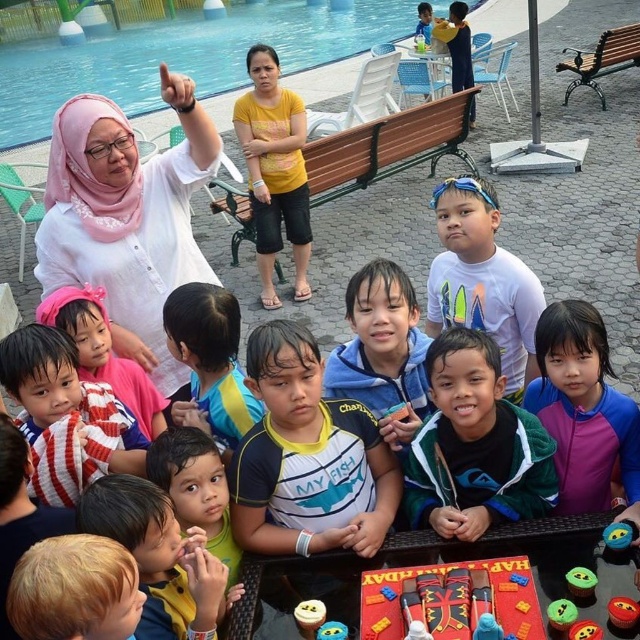
You are standing at the center of the paved area and want to find the striped jersey at center. Which direction should you walk to reach it?

The striped jersey at center is located at point 0.652 on the x axis and 0.105 on the y axis. Since you are at the center, which is at point 0.5 on both axes, you should walk towards the right and slightly downward to reach the striped jersey at center.

Based on the photo, you are a parent at the birthday party and want to place a new toy between the blue plastic pool at upper left and the smooth plastic toy at lower right. Where should you place it so it is between them?

You should place the new toy between the blue plastic pool at upper left and the smooth plastic toy at lower right by positioning it below the blue plastic pool at upper left and above the smooth plastic toy at lower right since the blue plastic pool at upper left is above the smooth plastic toy at lower right.